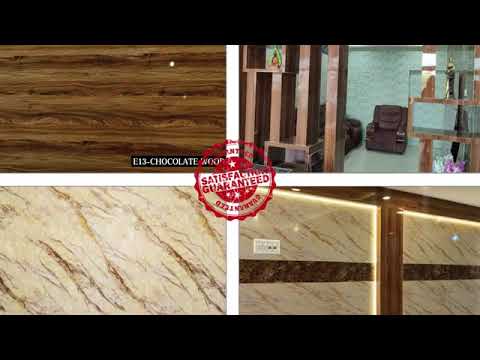
The image size is (480, 360). What are the coordinates of `floor` in the screenshot? It's located at (375, 163).